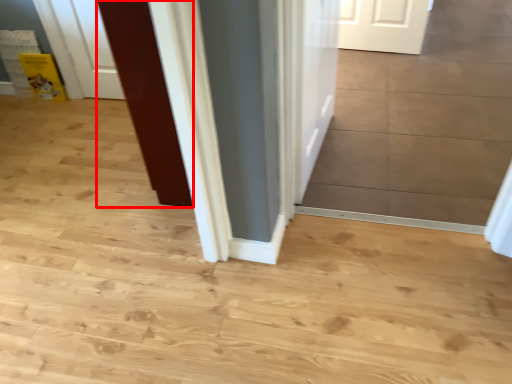
Question: Observing the image, what is the correct spatial positioning of door (annotated by the red box) in reference to door?

Choices:
 (A) left
 (B) right

Answer: (A)